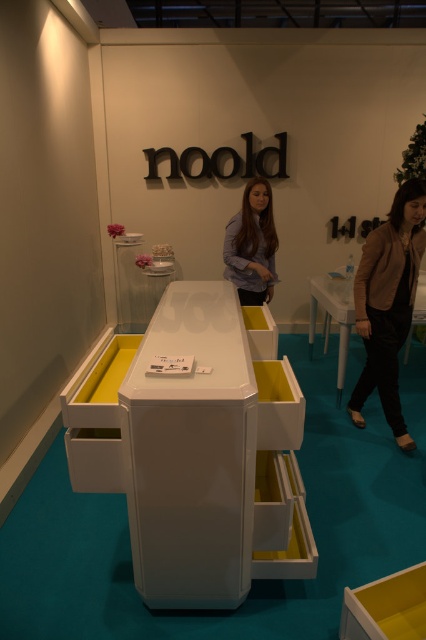
You are a photographer taking a picture of the noold furniture. You notice the black leather jacket at right and the matte blue shirt at center in the background. Which clothing item will appear larger in the photo?

The black leather jacket at right is much taller than the matte blue shirt at center, so it will appear larger in the photo.

You are a photographer standing in front of the white furniture. You notice a black leather jacket at right and a matte blue shirt at center. Which one is closer to you?

The black leather jacket at right is closer to you because it is in front of the matte blue shirt at center.